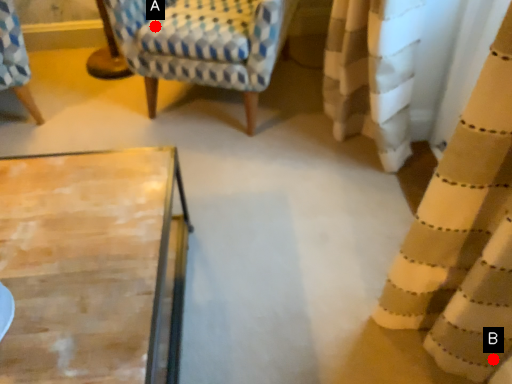
Question: Two points are circled on the image, labeled by A and B beside each circle. Which point is further to the camera?

Choices:
 (A) A is further
 (B) B is further

Answer: (A)